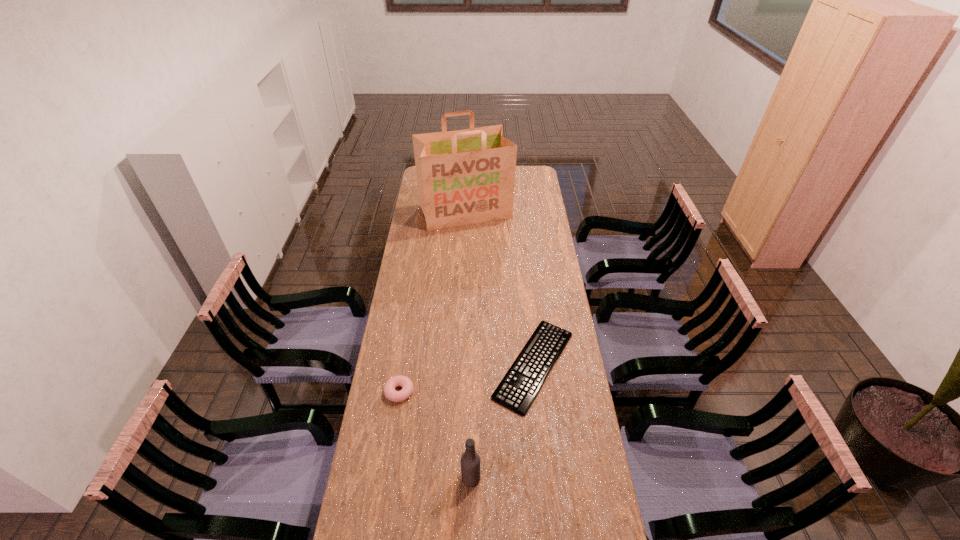
Find the location of `vacant space that is in between the second shortest object and the shortest object`. vacant space that is in between the second shortest object and the shortest object is located at coordinates (467, 379).

Find the location of `unoccupied position between the doughnut and the farthest object`. unoccupied position between the doughnut and the farthest object is located at coordinates click(x=432, y=302).

Where is `free spot between the grocery bag and the doughnut`? free spot between the grocery bag and the doughnut is located at coordinates tap(432, 302).

What are the coordinates of `free spot between the nearest object and the doughnut` in the screenshot? It's located at (435, 435).

Locate an element on the screen. blank region between the second shortest object and the third shortest object is located at coordinates (435, 435).

Select which object appears as the closest to the tallest object. Please provide its 2D coordinates. Your answer should be formatted as a tuple, i.e. [(x, y)], where the tuple contains the x and y coordinates of a point satisfying the conditions above.

[(518, 389)]

Where is `the second closest object relative to the shortest object`? This screenshot has width=960, height=540. the second closest object relative to the shortest object is located at coordinates (407, 386).

Where is `blank space that satisfies the following two spatial constraints: 1. on the front side of the computer keyboard; 2. on the side of the second tallest object with the label`? This screenshot has width=960, height=540. blank space that satisfies the following two spatial constraints: 1. on the front side of the computer keyboard; 2. on the side of the second tallest object with the label is located at coordinates (546, 478).

At what (x,y) coordinates should I click in order to perform the action: click on free spot that satisfies the following two spatial constraints: 1. on the front side of the computer keyboard; 2. on the side of the nearest object with the label. Please return your answer as a coordinate pair (x, y). The width and height of the screenshot is (960, 540). Looking at the image, I should click on (546, 478).

At what (x,y) coordinates should I click in order to perform the action: click on vacant space that satisfies the following two spatial constraints: 1. on the front side of the tallest object; 2. on the right side of the shortest object. Please return your answer as a coordinate pair (x, y). This screenshot has width=960, height=540. Looking at the image, I should click on (459, 365).